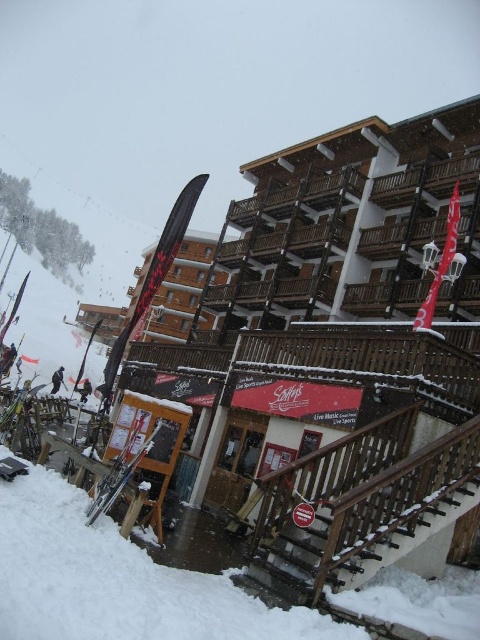
Find the location of a particular element. The image size is (480, 640). black glossy ski at center is located at coordinates (156, 269).

Does black glossy ski at center appear on the right side of dark gray snowboarder at lower left?

Correct, you'll find black glossy ski at center to the right of dark gray snowboarder at lower left.

What do you see at coordinates (156, 269) in the screenshot?
I see `black glossy ski at center` at bounding box center [156, 269].

At what (x,y) coordinates should I click in order to perform the action: click on black glossy ski at center. Please return your answer as a coordinate pair (x, y). Looking at the image, I should click on 156,269.

Does point (59, 374) lie in front of point (82, 392)?

No, (59, 374) is further to viewer.

Does dark gray snowboarder at lower left have a greater width compared to dark gray ski at lower left?

Correct, the width of dark gray snowboarder at lower left exceeds that of dark gray ski at lower left.

The width and height of the screenshot is (480, 640). Describe the element at coordinates (57, 380) in the screenshot. I see `dark gray snowboarder at lower left` at that location.

In order to click on dark gray snowboarder at lower left in this screenshot , I will do `click(57, 380)`.

Based on the photo, is metallic skis at lower left taller than dark gray snowboarder at lower left?

Incorrect, metallic skis at lower left's height is not larger of dark gray snowboarder at lower left's.

What do you see at coordinates (120, 472) in the screenshot?
I see `metallic skis at lower left` at bounding box center [120, 472].

The width and height of the screenshot is (480, 640). What are the coordinates of `metallic skis at lower left` in the screenshot? It's located at (120, 472).